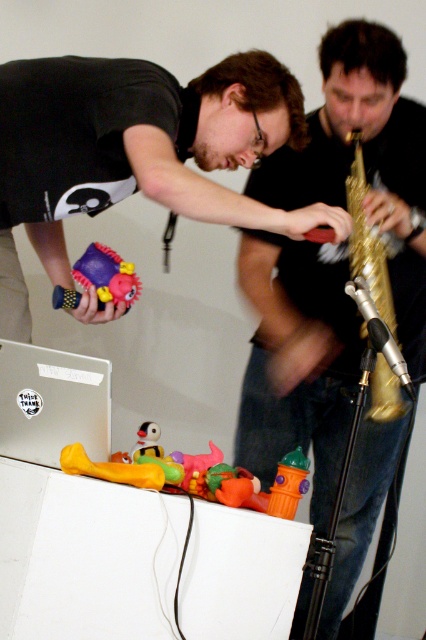
Question: Which of these objects is positioned closest to the yellow rubber duck at lower left?

Choices:
 (A) rubber fire hydrant at center
 (B) gold brass trumpet at upper right

Answer: (A)

Question: Is gold brass trumpet at upper right thinner than rubberized plastic toy at center?

Choices:
 (A) yes
 (B) no

Answer: (B)

Question: Can you confirm if matte black shirt at center is positioned above rubberized plastic toy at center?

Choices:
 (A) yes
 (B) no

Answer: (B)

Question: Which object is farther from the camera taking this photo?

Choices:
 (A) matte black toy at center
 (B) rubber fire hydrant at center
 (C) matte black shirt at center

Answer: (C)

Question: Where is yellow rubber duck at lower left located in relation to rubber duck at center in the image?

Choices:
 (A) left
 (B) right

Answer: (A)

Question: Based on their relative distances, which object is nearer to the rubber duck at center?

Choices:
 (A) matte black toy at center
 (B) rubber fire hydrant at center
 (C) gold brass trumpet at upper right

Answer: (B)